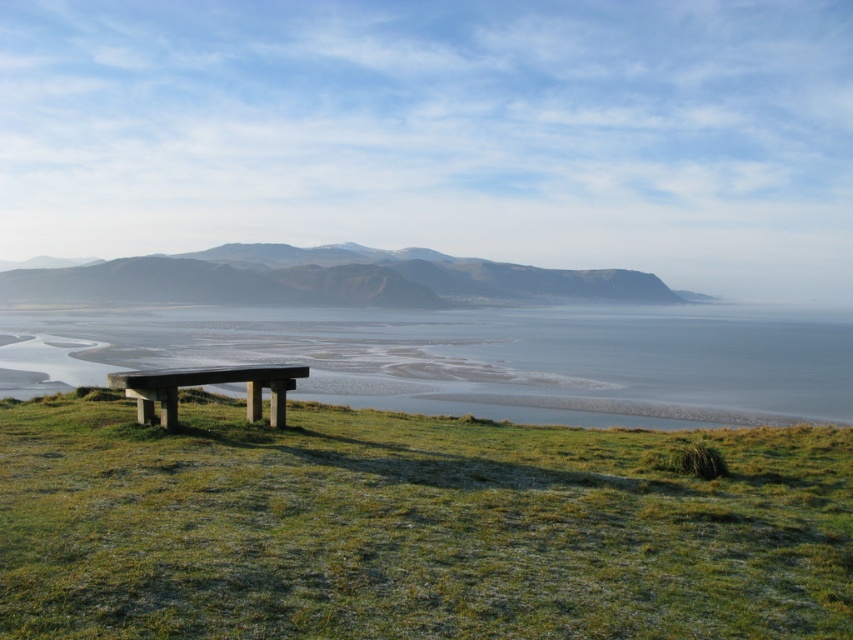
Which is more to the right, green grassy hillside at center or smooth concrete bench at lower left?

Positioned to the right is smooth concrete bench at lower left.

Between point (329, 289) and point (259, 369), which one is positioned in front?

Point (259, 369) is more forward.

You are a GUI agent. You are given a task and a screenshot of the screen. Output one action in this format:
    pyautogui.click(x=<x>, y=<y>)
    Task: Click on the green grassy hillside at center
    This screenshot has width=853, height=640.
    Given the screenshot: What is the action you would take?
    pyautogui.click(x=323, y=280)

This screenshot has width=853, height=640. I want to click on green grassy hillside at center, so click(x=323, y=280).

Is point (691, 532) behind point (735, 369)?

No, (691, 532) is closer to viewer.

Find the location of a particular element. Image resolution: width=853 pixels, height=640 pixels. green grassy at lower left is located at coordinates (410, 525).

Which is in front, point (6, 529) or point (514, 344)?

Point (6, 529) is in front.

Identify the location of green grassy at lower left. This screenshot has height=640, width=853. tap(410, 525).

Does clear water at bench left have a lesser width compared to green grassy hillside at center?

Yes.

Find the location of a particular element. The image size is (853, 640). clear water at bench left is located at coordinates (488, 356).

Is point (805, 380) less distant than point (451, 284)?

That is True.

Where is `clear water at bench left`? The width and height of the screenshot is (853, 640). clear water at bench left is located at coordinates (488, 356).